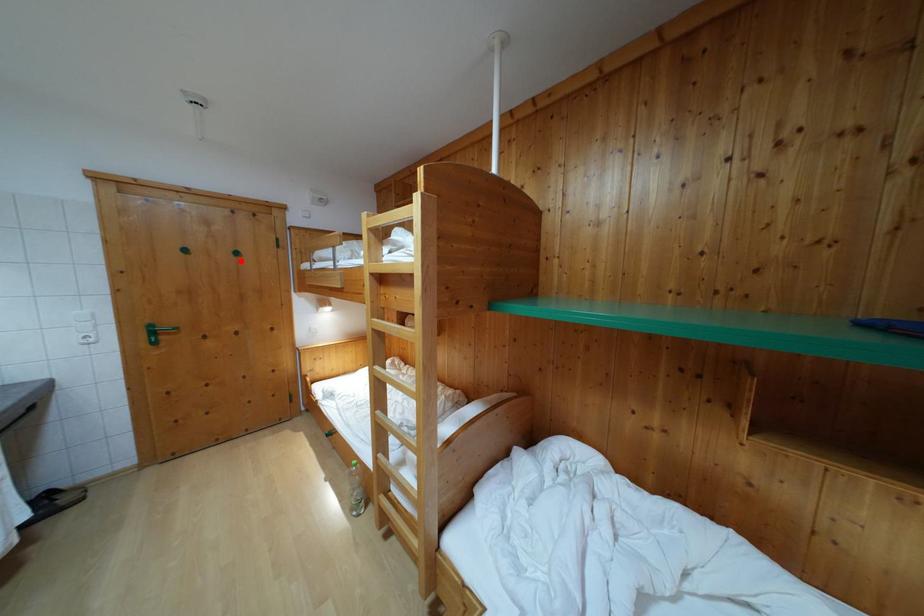
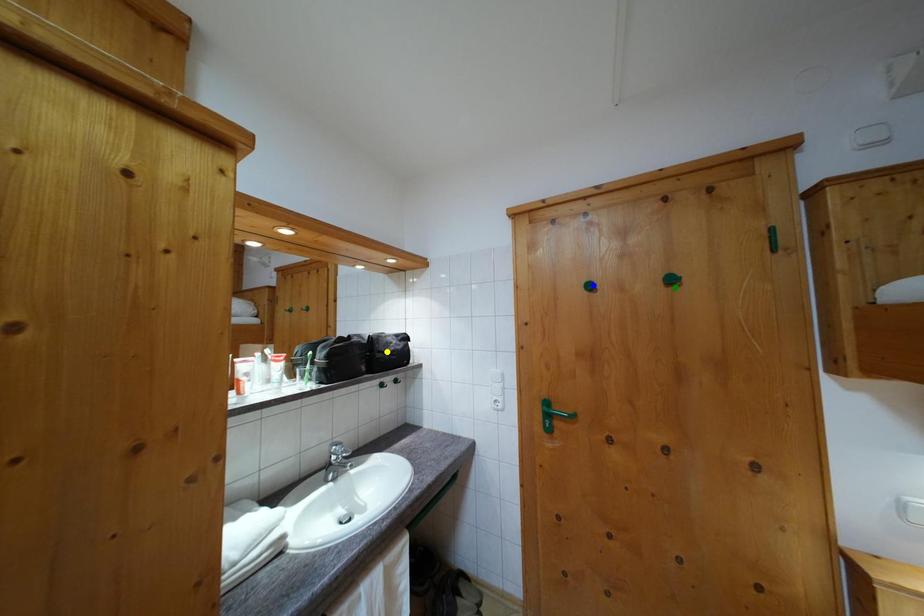
Question: I am providing you with two images of the same scene from different viewpoints. A red point is marked on the first image. You are given multiple points on the second image. In image 2, which mark is for the same physical point as the one in image 1?

Choices:
 (A) green point
 (B) blue point
 (C) yellow point

Answer: (A)